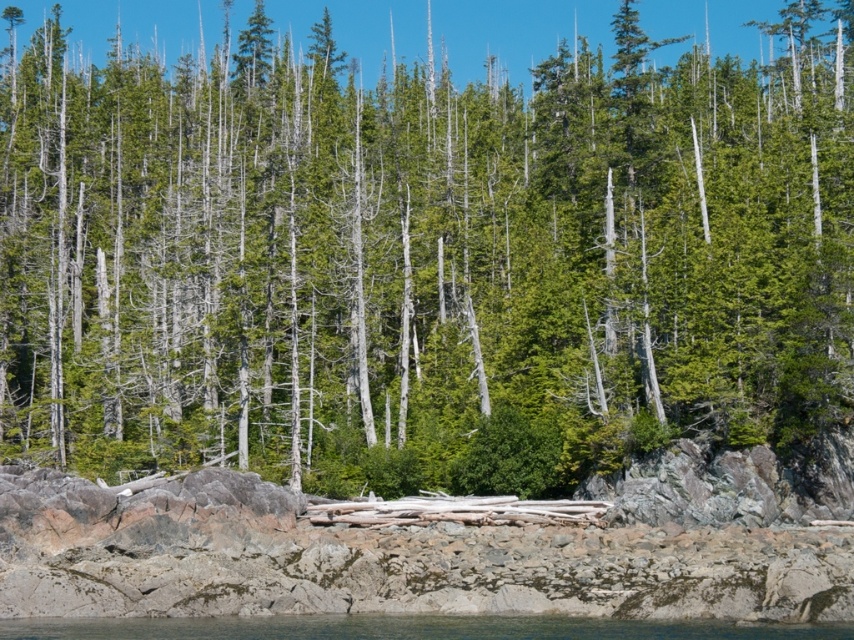
Based on the photo, you are a kayaker approaching the shoreline. You see a gray rock at lower center and a clear water at lower center. Which one is wider from your perspective?

The gray rock at lower center might be wider than clear water at lower center.